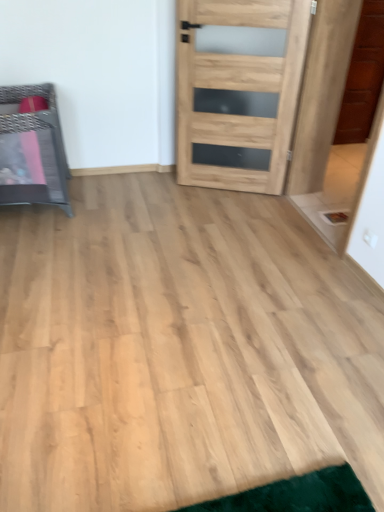
Question: From a real-world perspective, is natural wood door at center above or below metallic woven basket at left?

Choices:
 (A) below
 (B) above

Answer: (B)

Question: Based on their positions, is natural wood door at center located to the left or right of metallic woven basket at left?

Choices:
 (A) left
 (B) right

Answer: (B)

Question: Is natural wood door at center taller or shorter than metallic woven basket at left?

Choices:
 (A) tall
 (B) short

Answer: (A)

Question: Looking at their shapes, would you say metallic woven basket at left is wider or thinner than natural wood door at center?

Choices:
 (A) thin
 (B) wide

Answer: (B)

Question: From a real-world perspective, relative to natural wood door at center, is metallic woven basket at left vertically above or below?

Choices:
 (A) above
 (B) below

Answer: (B)

Question: In terms of height, does metallic woven basket at left look taller or shorter compared to natural wood door at center?

Choices:
 (A) tall
 (B) short

Answer: (B)

Question: Is point (61, 177) positioned closer to the camera than point (221, 86)?

Choices:
 (A) closer
 (B) farther

Answer: (B)